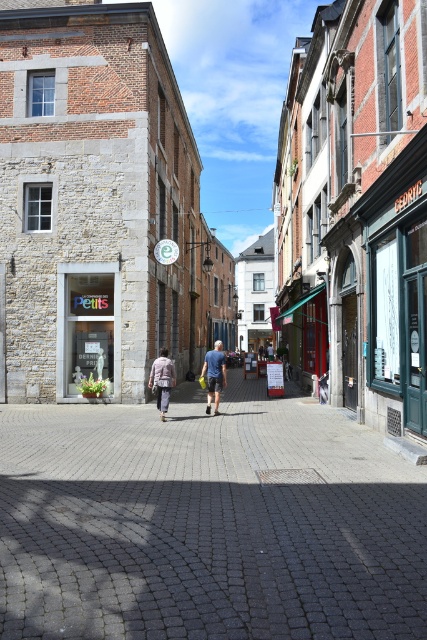
Locate an element on the screen. The width and height of the screenshot is (427, 640). green fabric awning at center is located at coordinates tap(307, 336).

Is gray cobblestone pavement at center taller than blue denim shorts at center?

In fact, gray cobblestone pavement at center may be shorter than blue denim shorts at center.

The height and width of the screenshot is (640, 427). I want to click on gray cobblestone pavement at center, so click(207, 524).

This screenshot has width=427, height=640. In order to click on gray cobblestone pavement at center in this screenshot , I will do `click(207, 524)`.

How distant is gray cobblestone pavement at center from light brown fabric jacket at center?

gray cobblestone pavement at center is 4.79 meters away from light brown fabric jacket at center.

Which is more to the left, gray cobblestone pavement at center or light brown fabric jacket at center?

light brown fabric jacket at center

Where is `gray cobblestone pavement at center`? Image resolution: width=427 pixels, height=640 pixels. gray cobblestone pavement at center is located at coordinates point(207,524).

You are a GUI agent. You are given a task and a screenshot of the screen. Output one action in this format:
    pyautogui.click(x=<x>, y=<y>)
    Task: Click on the gray cobblestone pavement at center
    
    Given the screenshot: What is the action you would take?
    pyautogui.click(x=207, y=524)